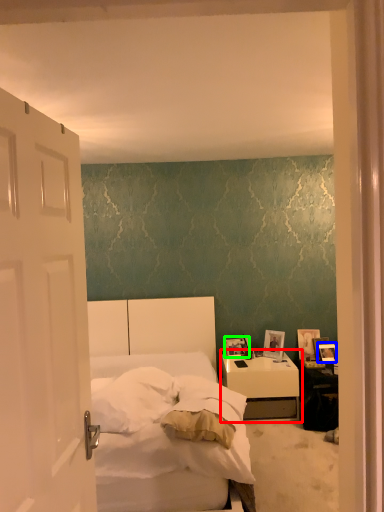
Question: Which is farther away from nightstand (highlighted by a red box)? picture frame (highlighted by a blue box) or picture frame (highlighted by a green box)?

Choices:
 (A) picture frame
 (B) picture frame

Answer: (A)